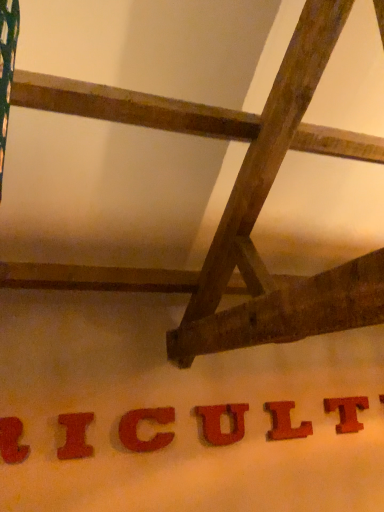
This screenshot has width=384, height=512. I want to click on matte red letter i at lower left, the second letter positioned from the left, so click(x=75, y=436).

The height and width of the screenshot is (512, 384). Identify the location of rustic wood letter u at center, marked as the 4th letter in a left-to-right arrangement. (220, 423).

Find the location of a particular element. wooden letter l at center, the 5th letter viewed from the left is located at coordinates (285, 422).

At what (x,y) coordinates should I click in order to perform the action: click on matte red letter at lower left, which is the sixth letter from right to left. Please return your answer as a coordinate pair (x, y). The image size is (384, 512). Looking at the image, I should click on click(x=12, y=441).

Is red matte letter c at center, acting as the fourth letter starting from the right, not close to matte red letter at lower left, which is the sixth letter from right to left?

No, red matte letter c at center, acting as the fourth letter starting from the right, is not far from matte red letter at lower left, which is the sixth letter from right to left.

Is red matte letter c at center, acting as the 3th letter starting from the left, wider or thinner than matte red letter at lower left, which is the sixth letter from right to left?

In the image, red matte letter c at center, acting as the 3th letter starting from the left, appears to be more narrow than matte red letter at lower left, which is the sixth letter from right to left.

In the scene shown: Measure the distance between red matte letter c at center, acting as the 3th letter starting from the left, and matte red letter at lower left, which is the sixth letter from right to left.

red matte letter c at center, acting as the 3th letter starting from the left, and matte red letter at lower left, which is the sixth letter from right to left, are 24.29 inches apart.

From the image's perspective, is red matte letter c at center, acting as the 3th letter starting from the left, located above or below matte red letter at lower left, the first letter when ordered from left to right?

Clearly, from the image's perspective, red matte letter c at center, acting as the 3th letter starting from the left, is below matte red letter at lower left, the first letter when ordered from left to right.

From the picture: How different are the orientations of rustic wood letter u at center, marked as the 4th letter in a left-to-right arrangement, and red matte letter c at center, acting as the 3th letter starting from the left, in degrees?

They differ by 0.0219 degrees in their facing directions.

Which of these two, rustic wood letter u at center, the third letter positioned from the right, or red matte letter c at center, acting as the 3th letter starting from the left, is bigger?

With larger size is red matte letter c at center, acting as the 3th letter starting from the left.

Is rustic wood letter u at center, the third letter positioned from the right, next to red matte letter c at center, acting as the 3th letter starting from the left, and touching it?

They are not placed beside each other.

Which object is further away from the camera taking this photo, rustic wood letter u at center, marked as the 4th letter in a left-to-right arrangement, or red matte letter c at center, acting as the fourth letter starting from the right?

rustic wood letter u at center, marked as the 4th letter in a left-to-right arrangement, is behind.

Between matte red letter i at lower left, the second letter positioned from the left, and rustic wood letter u at center, marked as the 4th letter in a left-to-right arrangement, which one appears on the right side from the viewer's perspective?

From the viewer's perspective, rustic wood letter u at center, marked as the 4th letter in a left-to-right arrangement, appears more on the right side.

In terms of width, does matte red letter i at lower left, the second letter positioned from the left, look wider or thinner when compared to rustic wood letter u at center, the third letter positioned from the right?

matte red letter i at lower left, the second letter positioned from the left, is wider than rustic wood letter u at center, the third letter positioned from the right.

From the image's perspective, between matte red letter i at lower left, the second letter positioned from the left, and rustic wood letter u at center, marked as the 4th letter in a left-to-right arrangement, which one is located above?

matte red letter i at lower left, the second letter positioned from the left.

From the picture: Could rustic wood letter u at center, the third letter positioned from the right, be considered to be inside matte red letter i at lower left, marked as the 5th letter in a right-to-left arrangement?

No, rustic wood letter u at center, the third letter positioned from the right, is located outside of matte red letter i at lower left, marked as the 5th letter in a right-to-left arrangement.

Can we say wooden letter l at center, arranged as the second letter when viewed from the right, lies outside rustic wood letter u at center, the third letter positioned from the right?

Indeed, wooden letter l at center, arranged as the second letter when viewed from the right, is completely outside rustic wood letter u at center, the third letter positioned from the right.

From a real-world perspective, which is physically below, wooden letter l at center, arranged as the second letter when viewed from the right, or rustic wood letter u at center, the third letter positioned from the right?

rustic wood letter u at center, the third letter positioned from the right, from a real-world perspective.

Which of these two, wooden letter l at center, the 5th letter viewed from the left, or rustic wood letter u at center, the third letter positioned from the right, is thinner?

Thinner between the two is rustic wood letter u at center, the third letter positioned from the right.

Does red matte letter c at center, acting as the 3th letter starting from the left, have a greater width compared to wooden letter l at center, arranged as the second letter when viewed from the right?

Correct, the width of red matte letter c at center, acting as the 3th letter starting from the left, exceeds that of wooden letter l at center, arranged as the second letter when viewed from the right.

Is red matte letter c at center, acting as the 3th letter starting from the left, not inside wooden letter l at center, the 5th letter viewed from the left?

Yes, red matte letter c at center, acting as the 3th letter starting from the left, is located beyond the bounds of wooden letter l at center, the 5th letter viewed from the left.

Looking at this image, is red matte letter c at center, acting as the 3th letter starting from the left, smaller than wooden letter l at center, the 5th letter viewed from the left?

No, red matte letter c at center, acting as the 3th letter starting from the left, is not smaller than wooden letter l at center, the 5th letter viewed from the left.

From the picture: From the image's perspective, would you say red matte letter c at center, acting as the fourth letter starting from the right, is shown under wooden letter l at center, the 5th letter viewed from the left?

Incorrect, from the image's perspective, red matte letter c at center, acting as the fourth letter starting from the right, is higher than wooden letter l at center, the 5th letter viewed from the left.

Is red wood letter t at lower right, the sixth letter viewed from the left, placed right next to matte red letter at lower left, which is the sixth letter from right to left?

There is a gap between red wood letter t at lower right, the sixth letter viewed from the left, and matte red letter at lower left, which is the sixth letter from right to left.

Considering the sizes of objects red wood letter t at lower right, the first letter viewed from the right, and matte red letter at lower left, which is the sixth letter from right to left, in the image provided, who is bigger, red wood letter t at lower right, the first letter viewed from the right, or matte red letter at lower left, which is the sixth letter from right to left,?

matte red letter at lower left, which is the sixth letter from right to left, is bigger.

Is red wood letter t at lower right, the sixth letter viewed from the left, positioned with its back to matte red letter at lower left, the first letter when ordered from left to right?

That's not correct — red wood letter t at lower right, the sixth letter viewed from the left, is not looking away from matte red letter at lower left, the first letter when ordered from left to right.

Which is more to the right, red wood letter t at lower right, the sixth letter viewed from the left, or matte red letter at lower left, which is the sixth letter from right to left?

From the viewer's perspective, red wood letter t at lower right, the sixth letter viewed from the left, appears more on the right side.

Which object is thinner, red wood letter t at lower right, the sixth letter viewed from the left, or wooden letter l at center, arranged as the second letter when viewed from the right?

Thinner between the two is wooden letter l at center, arranged as the second letter when viewed from the right.

Considering the relative sizes of red wood letter t at lower right, the sixth letter viewed from the left, and wooden letter l at center, the 5th letter viewed from the left, in the image provided, is red wood letter t at lower right, the sixth letter viewed from the left, bigger than wooden letter l at center, the 5th letter viewed from the left,?

Indeed, red wood letter t at lower right, the sixth letter viewed from the left, has a larger size compared to wooden letter l at center, the 5th letter viewed from the left.

From a real-world perspective, is red wood letter t at lower right, the first letter viewed from the right, positioned above or below wooden letter l at center, the 5th letter viewed from the left?

red wood letter t at lower right, the first letter viewed from the right, is above wooden letter l at center, the 5th letter viewed from the left.

Is red wood letter t at lower right, the sixth letter viewed from the left, turned away from wooden letter l at center, arranged as the second letter when viewed from the right?

red wood letter t at lower right, the sixth letter viewed from the left, is not turned away from wooden letter l at center, arranged as the second letter when viewed from the right.

Starting from the red matte letter c at center, acting as the fourth letter starting from the right, which letter is the 2nd one in front? Please provide its 2D coordinates.

[(12, 441)]

From the image's perspective, starting from the red matte letter c at center, acting as the 3th letter starting from the left, which letter is the 1st one below? Please provide its 2D coordinates.

[(220, 423)]

When comparing their distances from rustic wood letter u at center, marked as the 4th letter in a left-to-right arrangement, does matte red letter i at lower left, marked as the 5th letter in a right-to-left arrangement, or wooden letter l at center, arranged as the second letter when viewed from the right, seem closer?

wooden letter l at center, arranged as the second letter when viewed from the right.

Consider the image. Estimate the real-world distances between objects in this image. Which object is further from matte red letter at lower left, which is the sixth letter from right to left, red matte letter c at center, acting as the fourth letter starting from the right, or red wood letter t at lower right, the sixth letter viewed from the left?

red wood letter t at lower right, the sixth letter viewed from the left, is further to matte red letter at lower left, which is the sixth letter from right to left.

Based on their spatial positions, is red matte letter c at center, acting as the 3th letter starting from the left, or matte red letter at lower left, which is the sixth letter from right to left, closer to rustic wood letter u at center, the third letter positioned from the right?

red matte letter c at center, acting as the 3th letter starting from the left, is closer to rustic wood letter u at center, the third letter positioned from the right.

Which object lies nearer to the anchor point matte red letter i at lower left, the second letter positioned from the left, wooden letter l at center, the 5th letter viewed from the left, or red wood letter t at lower right, the first letter viewed from the right?

wooden letter l at center, the 5th letter viewed from the left, lies closer to matte red letter i at lower left, the second letter positioned from the left, than the other object.

Which object lies nearer to the anchor point red matte letter c at center, acting as the 3th letter starting from the left, matte red letter at lower left, which is the sixth letter from right to left, or matte red letter i at lower left, marked as the 5th letter in a right-to-left arrangement?

The object closer to red matte letter c at center, acting as the 3th letter starting from the left, is matte red letter i at lower left, marked as the 5th letter in a right-to-left arrangement.

Estimate the real-world distances between objects in this image. Which object is further from red wood letter t at lower right, the first letter viewed from the right, matte red letter i at lower left, marked as the 5th letter in a right-to-left arrangement, or wooden letter l at center, the 5th letter viewed from the left?

The object further to red wood letter t at lower right, the first letter viewed from the right, is matte red letter i at lower left, marked as the 5th letter in a right-to-left arrangement.

Which object lies further to the anchor point red wood letter t at lower right, the sixth letter viewed from the left, red matte letter c at center, acting as the fourth letter starting from the right, or rustic wood letter u at center, the third letter positioned from the right?

Among the two, red matte letter c at center, acting as the fourth letter starting from the right, is located further to red wood letter t at lower right, the sixth letter viewed from the left.

Looking at the image, which one is located further to rustic wood letter u at center, marked as the 4th letter in a left-to-right arrangement, red matte letter c at center, acting as the fourth letter starting from the right, or red wood letter t at lower right, the sixth letter viewed from the left?

red wood letter t at lower right, the sixth letter viewed from the left.

The image size is (384, 512). I want to click on letter located between rustic wood letter u at center, the third letter positioned from the right, and red wood letter t at lower right, the first letter viewed from the right, in the left-right direction, so click(285, 422).

This screenshot has width=384, height=512. I want to click on letter between matte red letter at lower left, which is the sixth letter from right to left, and red matte letter c at center, acting as the 3th letter starting from the left, in the horizontal direction, so click(75, 436).

Locate an element on the screen. This screenshot has height=512, width=384. letter between red matte letter c at center, acting as the fourth letter starting from the right, and wooden letter l at center, the 5th letter viewed from the left, from left to right is located at coordinates (220, 423).

This screenshot has width=384, height=512. I want to click on letter between matte red letter i at lower left, marked as the 5th letter in a right-to-left arrangement, and rustic wood letter u at center, the third letter positioned from the right, from left to right, so click(138, 426).